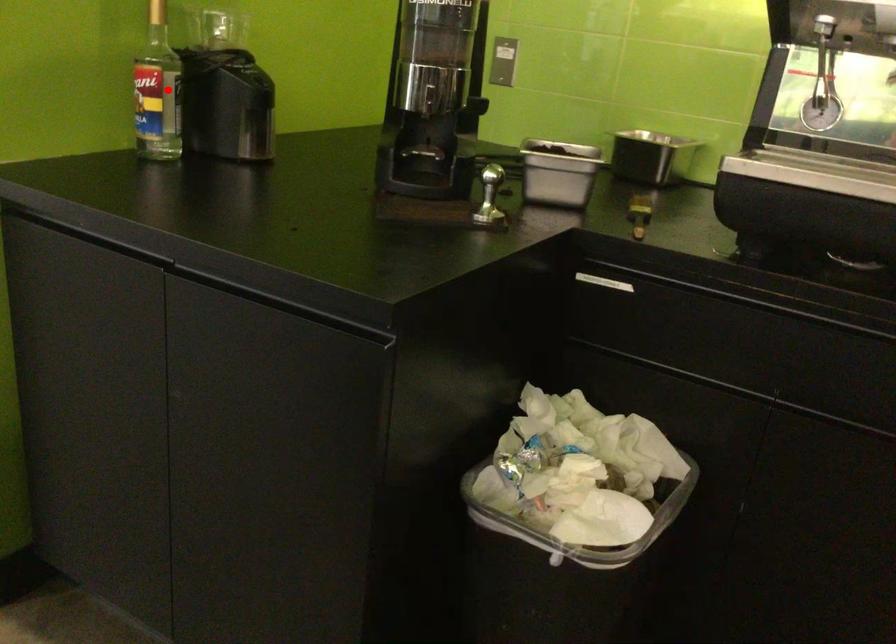
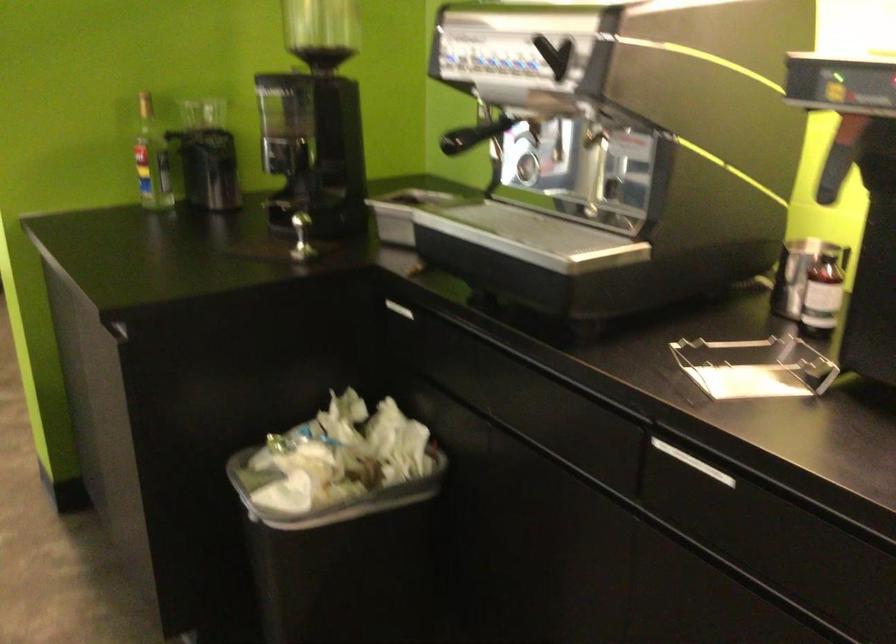
Where in the second image is the point corresponding to the highlighted location from the first image?

(151, 158)